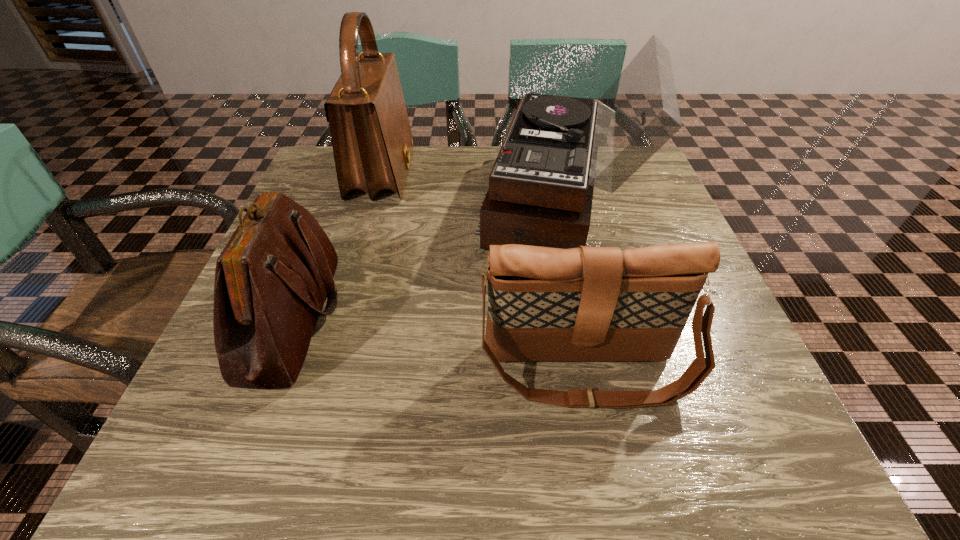
Locate an element on the screen. shoulder bag located in the right edge section of the desktop is located at coordinates click(x=586, y=303).

Identify the location of object at the far left corner. (372, 142).

At what (x,y) coordinates should I click in order to perform the action: click on object at the far right corner. Please return your answer as a coordinate pair (x, y). Image resolution: width=960 pixels, height=540 pixels. Looking at the image, I should click on (557, 149).

This screenshot has width=960, height=540. I want to click on object situated at the near right corner, so click(586, 303).

At what (x,y) coordinates should I click in order to perform the action: click on free region at the far edge of the desktop. Please return your answer as a coordinate pair (x, y). Image resolution: width=960 pixels, height=540 pixels. Looking at the image, I should click on click(448, 178).

The width and height of the screenshot is (960, 540). Find the location of `free space at the near edge of the desktop`. free space at the near edge of the desktop is located at coordinates (619, 455).

Where is `blank space at the right edge of the desktop`? blank space at the right edge of the desktop is located at coordinates [x=662, y=212].

Locate an element on the screen. The width and height of the screenshot is (960, 540). vacant area at the near right corner is located at coordinates (778, 434).

Locate an element on the screen. The width and height of the screenshot is (960, 540). empty space that is in between the farthest shoulder bag and the record player is located at coordinates (472, 188).

Locate an element on the screen. The height and width of the screenshot is (540, 960). free space between the tallest shoulder bag and the record player is located at coordinates (472, 188).